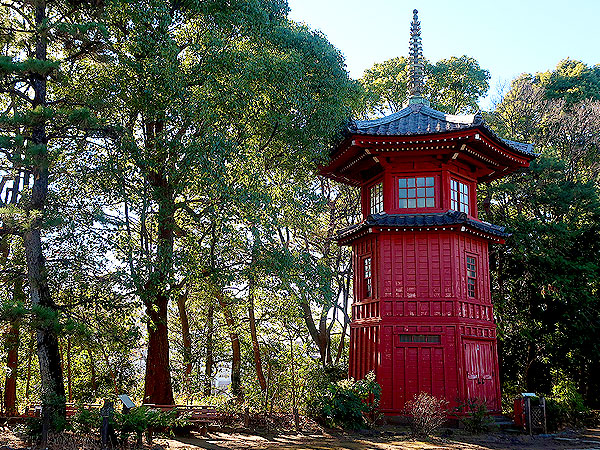
Locate an element on the screen. second floor window  left is located at coordinates (371, 267).